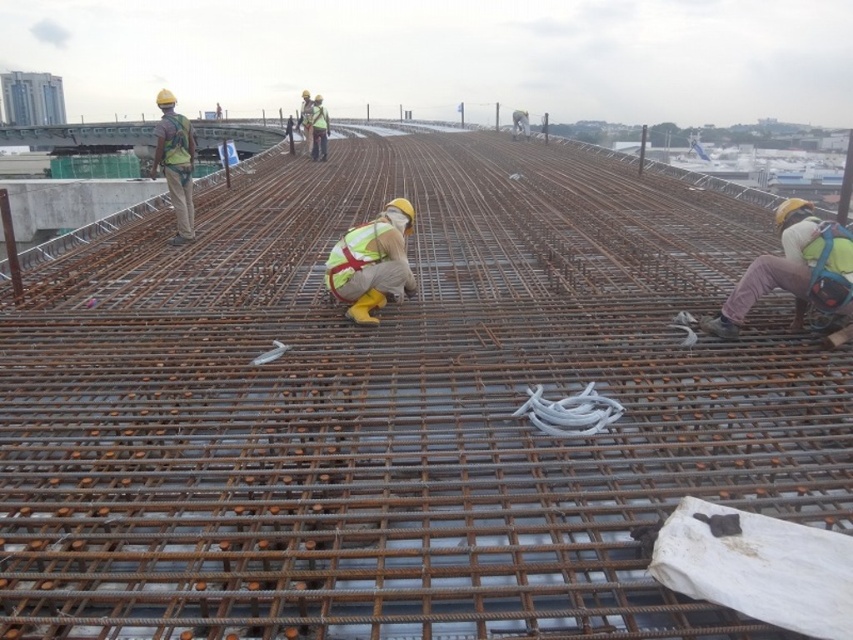
You are a construction inspector reviewing the site layout. You notice a point marked at coordinates (x=372, y=262). What object is located at that point?

The point at coordinates (x=372, y=262) indicates the reflective safety vest at center.